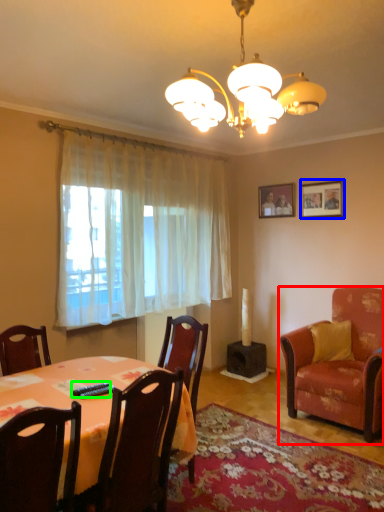
Question: Estimate the real-world distances between objects in this image. Which object is closer to chair (highlighted by a red box), picture frame (highlighted by a blue box) or remote control (highlighted by a green box)?

Choices:
 (A) picture frame
 (B) remote control

Answer: (A)